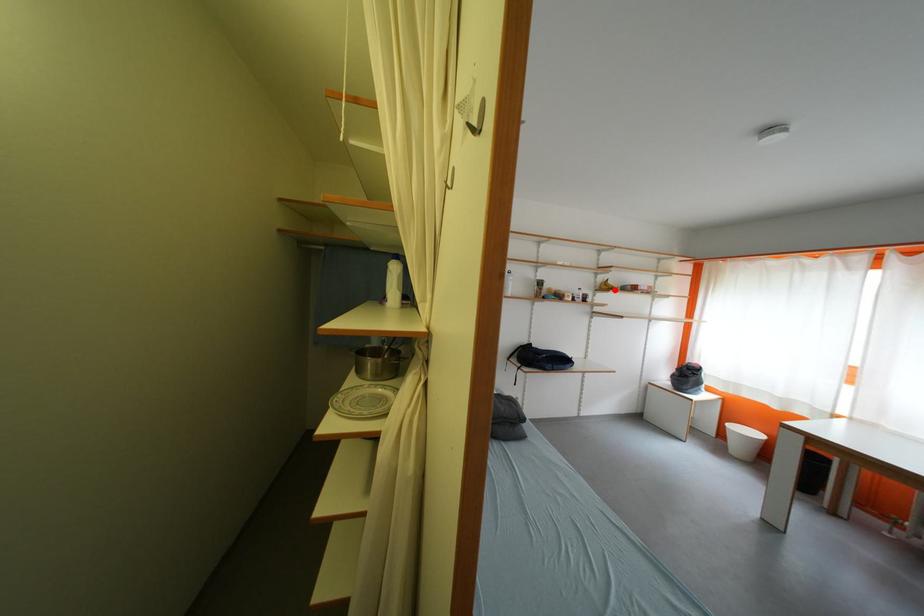
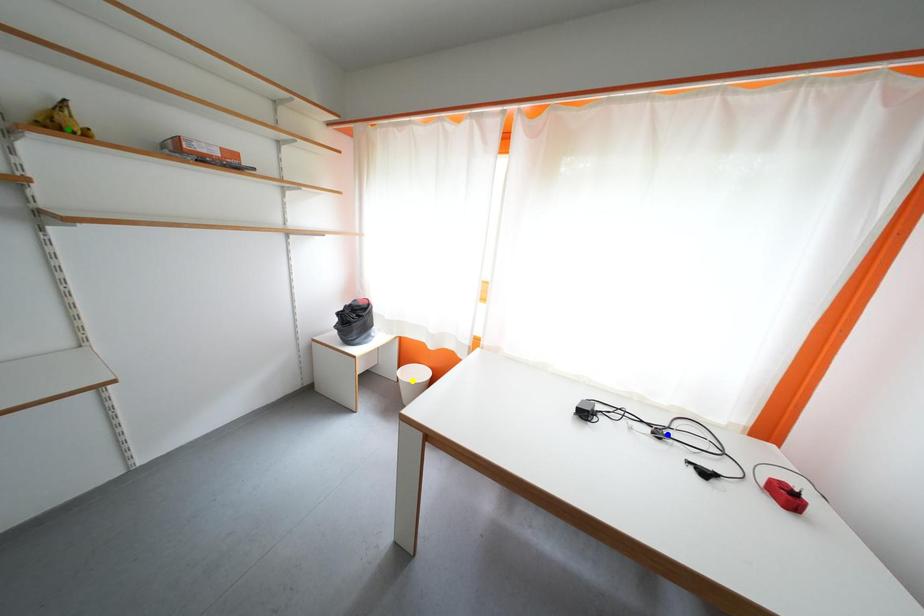
Question: I am providing you with two images of the same scene from different viewpoints. A red point is marked on the first image. You are given multiple points on the second image. In image 2, which mark is for the same physical point as the one in image 1?

Choices:
 (A) blue point
 (B) green point
 (C) yellow point

Answer: (B)